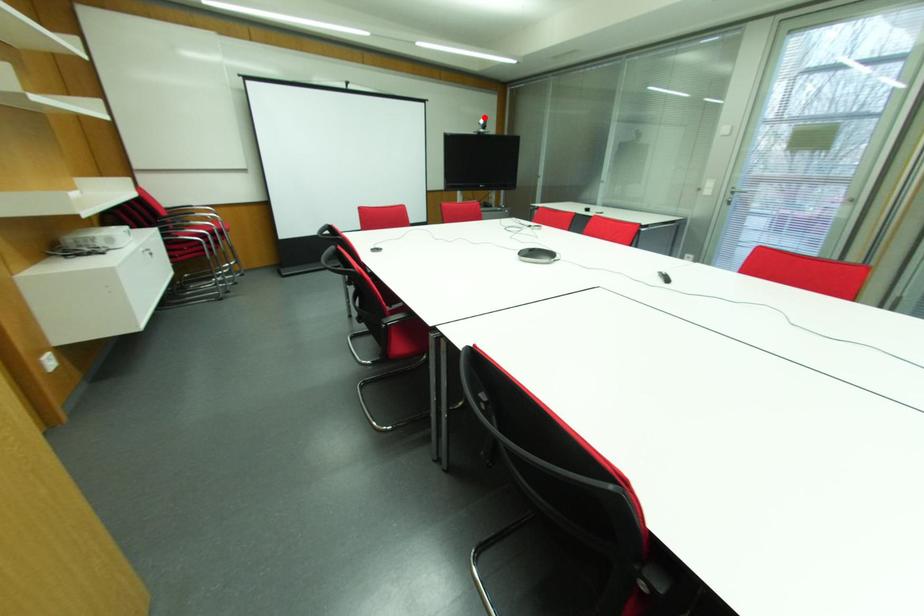
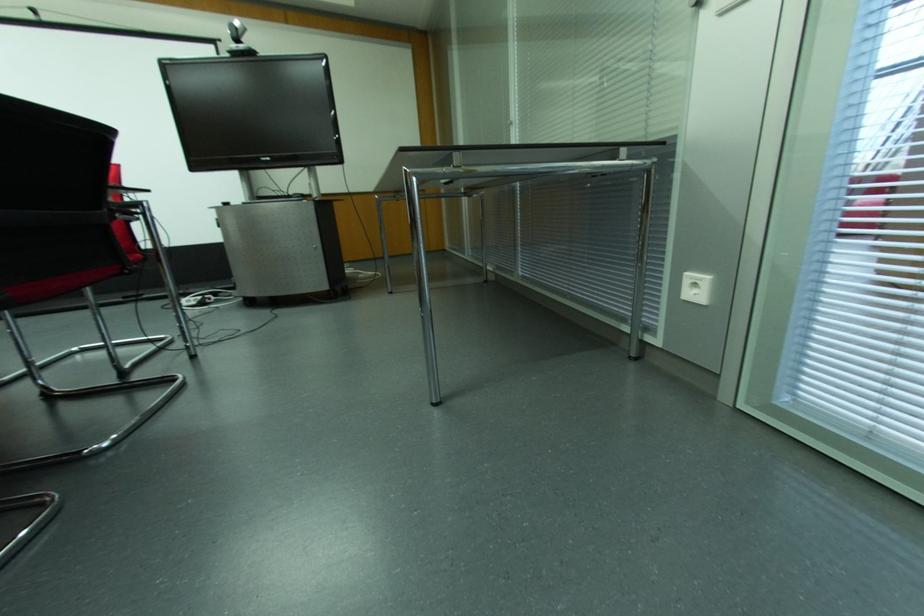
Question: A red point is marked in image1. In image2, is the corresponding 3D point closer to the camera or farther? Reply with the corresponding letter.

Choices:
 (A) The corresponding 3D point is closer.
 (B) The corresponding 3D point is farther.

Answer: (B)